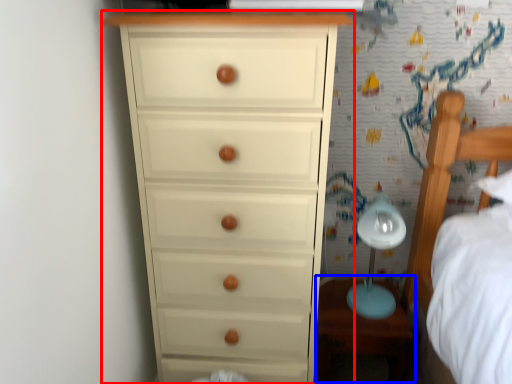
Question: Which object appears closest to the camera in this image, chest of drawers (highlighted by a red box) or table (highlighted by a blue box)?

Choices:
 (A) chest of drawers
 (B) table

Answer: (A)